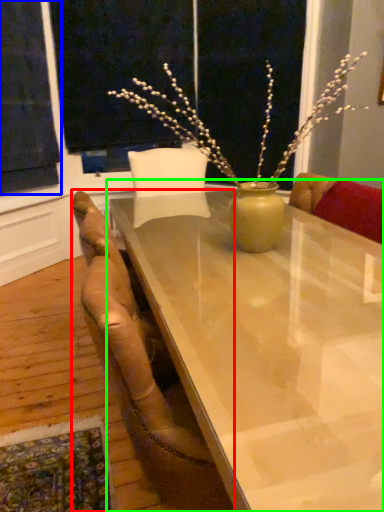
Question: Considering the real-world distances, which object is farthest from chair (highlighted by a red box)? curtain (highlighted by a blue box) or table (highlighted by a green box)?

Choices:
 (A) curtain
 (B) table

Answer: (A)